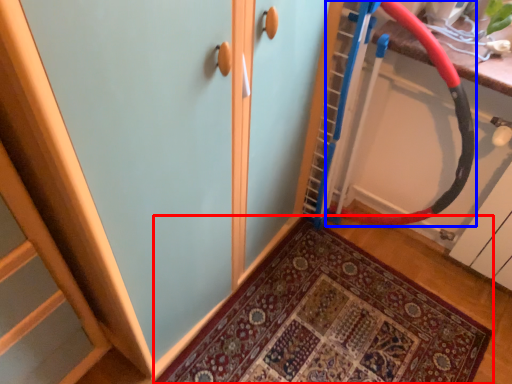
Question: Which of the following is the closest to the observer, door (highlighted by a red box) or battle rope (highlighted by a blue box)?

Choices:
 (A) door
 (B) battle rope

Answer: (B)